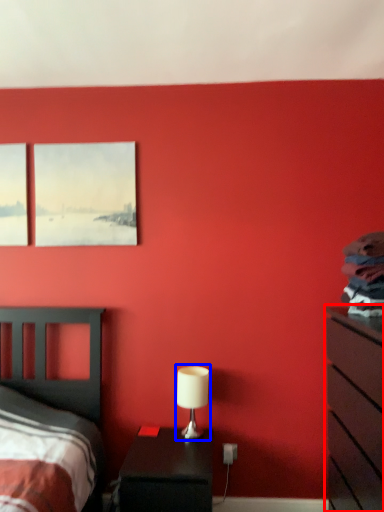
Question: Which object appears farthest to the camera in this image, chest of drawers (highlighted by a red box) or table lamp (highlighted by a blue box)?

Choices:
 (A) chest of drawers
 (B) table lamp

Answer: (B)